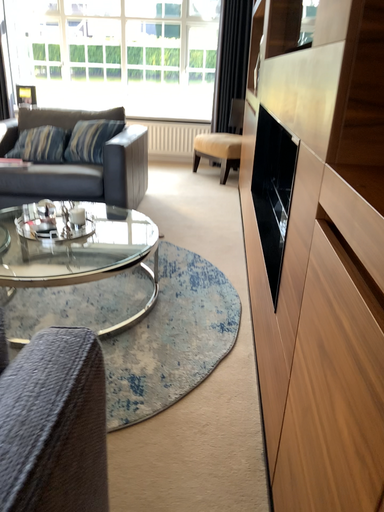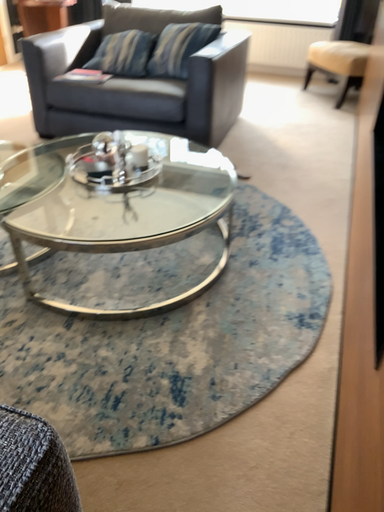
Question: How did the camera likely rotate when shooting the video?

Choices:
 (A) rotated downward
 (B) rotated upward

Answer: (A)